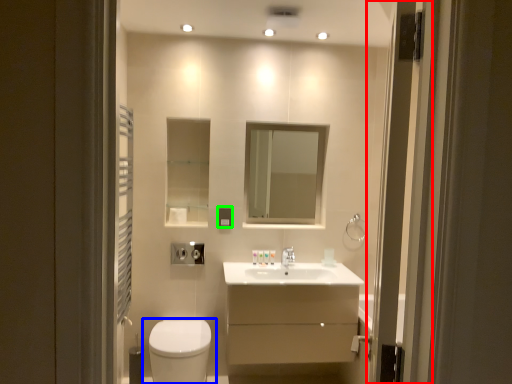
Question: Estimate the real-world distances between objects in this image. Which object is closer to screen door (highlighted by a red box), toilet (highlighted by a blue box) or light switch (highlighted by a green box)?

Choices:
 (A) toilet
 (B) light switch

Answer: (A)